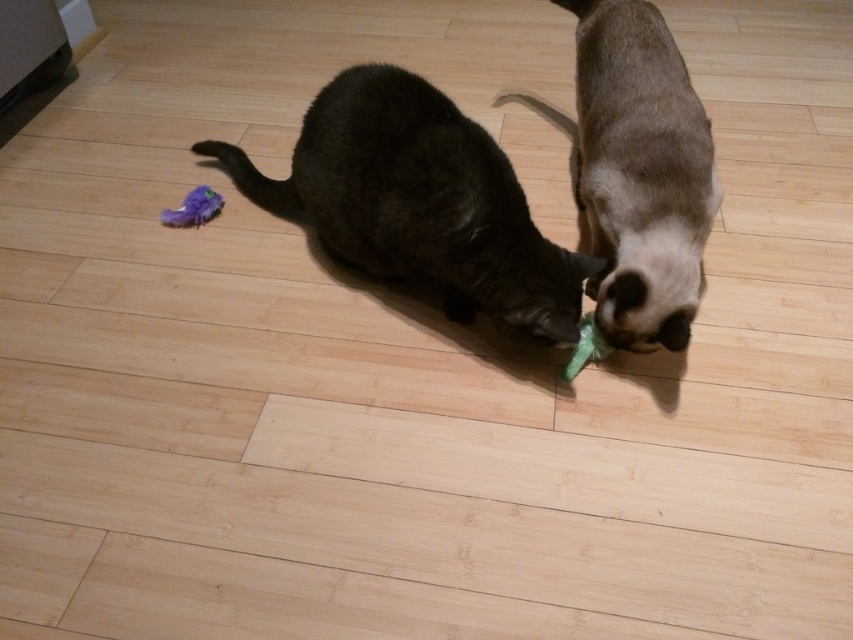
You are a pet owner observing two cats in the scene. The dark brown fur cat at center and the satin fur cat at center. Which cat is positioned to the left?

The dark brown fur cat at center is positioned to the left of the satin fur cat at center.

You are a pet owner who wants to place a toy between the dark brown fur cat at center and the satin fur cat at center. Based on their positions, which cat is closer to the floor where you can easily reach to place the toy?

The dark brown fur cat at center is positioned under the satin fur cat at center, so it is closer to the floor and easier to reach.

You are a photographer standing at a certain distance from the dark brown fur cat at center. You want to take a closeup photo of the cat without moving the camera. What should you do?

You should use a zoom lens to get a closeup of the dark brown fur cat at center without moving the camera, since the distance between them is 1.60 meters.